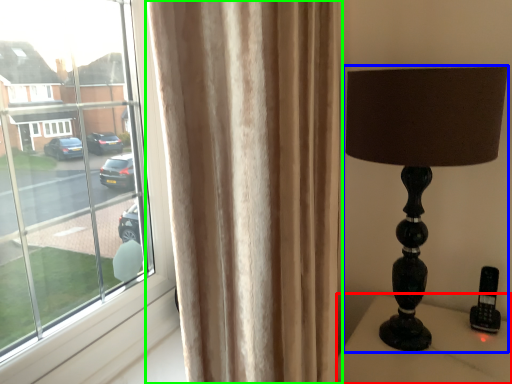
Question: Which object is the farthest from furniture (highlighted by a red box)? Choose among these: lamp (highlighted by a blue box) or curtain (highlighted by a green box).

Choices:
 (A) lamp
 (B) curtain

Answer: (B)